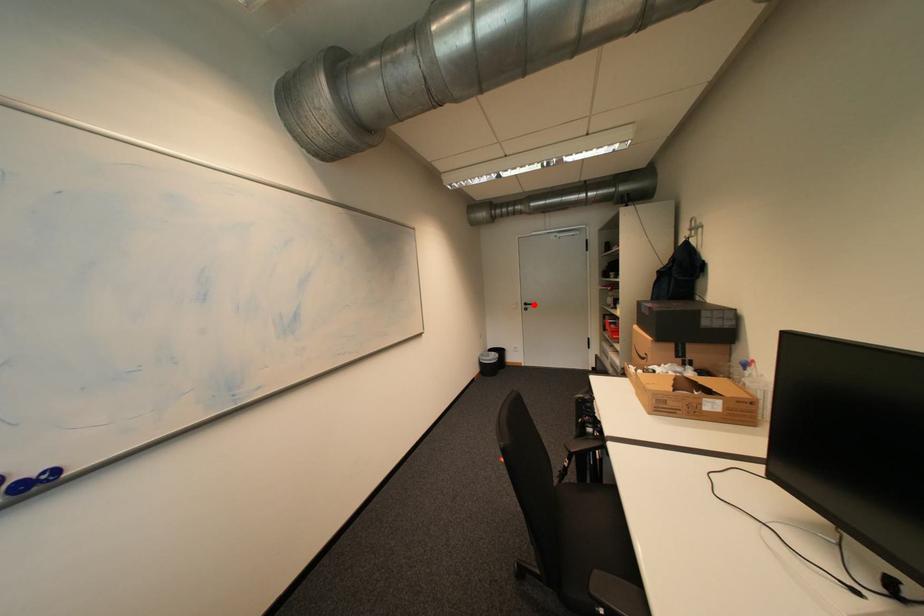
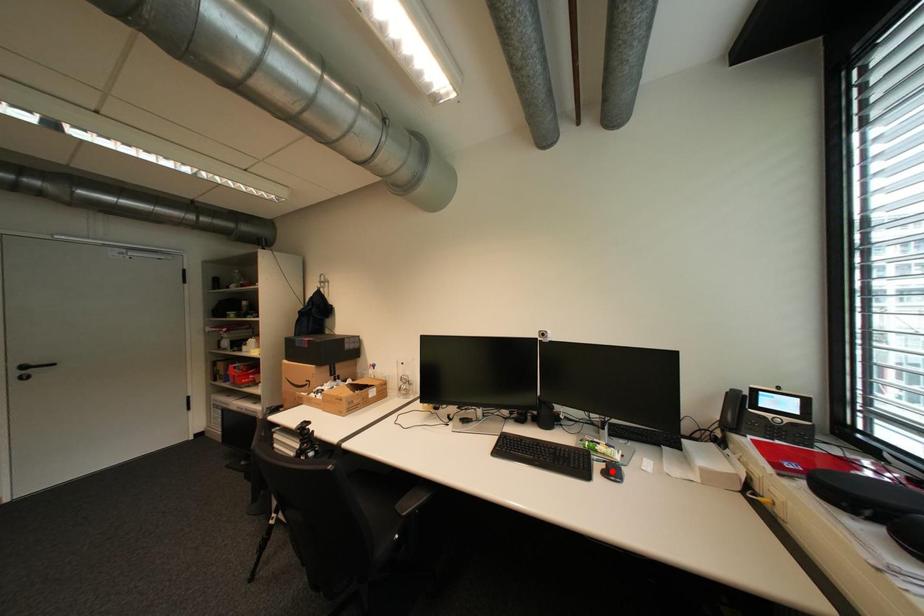
I am providing you with two images of the same scene from different viewpoints. A red point is marked on the first image and another point is marked on the second image. Is the red point in image1 aligned with the point shown in image2?

No